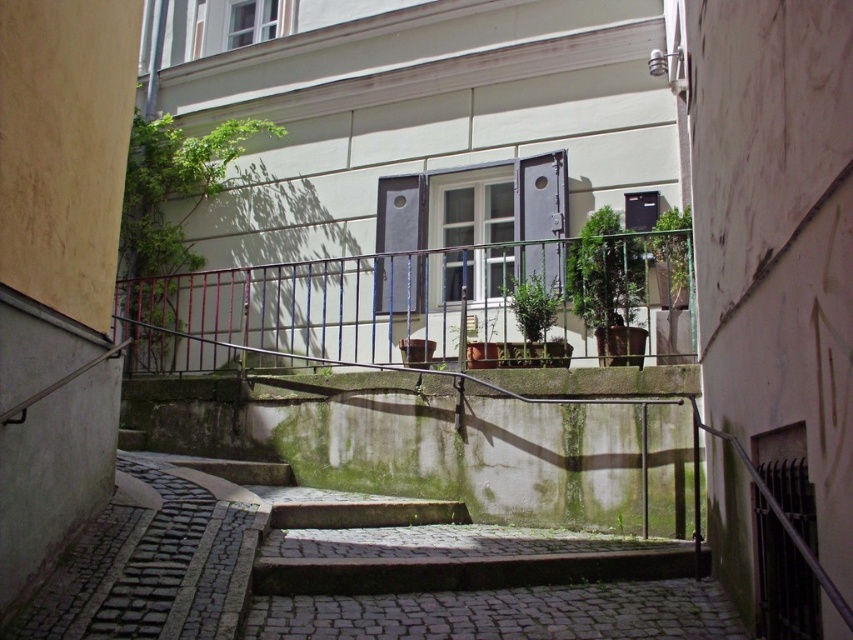
Between green leafy plant at left and green leafy plant at center, which one is positioned higher?

Positioned higher is green leafy plant at left.

Does point (155, 342) come farther from viewer compared to point (595, 308)?

Yes, point (155, 342) is behind point (595, 308).

Where is `green leafy plant at left`? Image resolution: width=853 pixels, height=640 pixels. green leafy plant at left is located at coordinates (169, 208).

Who is positioned more to the right, green matte plant at center or green leafy plant at upper center?

Positioned to the right is green leafy plant at upper center.

Does green matte plant at center have a lesser height compared to green leafy plant at upper center?

In fact, green matte plant at center may be taller than green leafy plant at upper center.

Identify the location of green matte plant at center. The image size is (853, 640). (532, 326).

Looking at this image, can you confirm if green leafy plant at left is thinner than green matte plant at center?

Incorrect, green leafy plant at left's width is not less than green matte plant at center's.

Locate an element on the screen. The height and width of the screenshot is (640, 853). green leafy plant at left is located at coordinates (169, 208).

Between point (148, 237) and point (509, 300), which one is positioned in front?

Positioned in front is point (509, 300).

Where is `green leafy plant at left`? The height and width of the screenshot is (640, 853). green leafy plant at left is located at coordinates (169, 208).